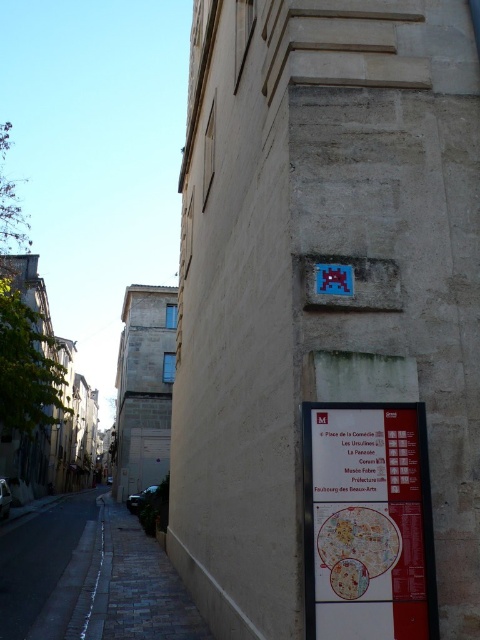
Can you confirm if white paper map at lower right is taller than dark asphalt road at lower left?

Incorrect, white paper map at lower right's height is not larger of dark asphalt road at lower left's.

This screenshot has height=640, width=480. What do you see at coordinates (368, 522) in the screenshot? I see `white paper map at lower right` at bounding box center [368, 522].

Identify the location of white paper map at lower right. (368, 522).